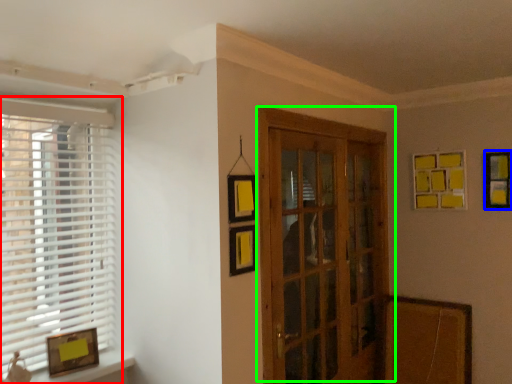
Question: Considering the real-world distances, which object is farthest from window (highlighted by a red box)? picture frame (highlighted by a blue box) or door (highlighted by a green box)?

Choices:
 (A) picture frame
 (B) door

Answer: (A)